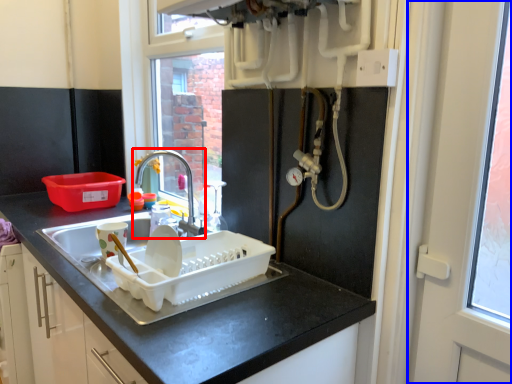
Question: Which object is further to the camera taking this photo, tap (highlighted by a red box) or screen door (highlighted by a blue box)?

Choices:
 (A) tap
 (B) screen door

Answer: (A)